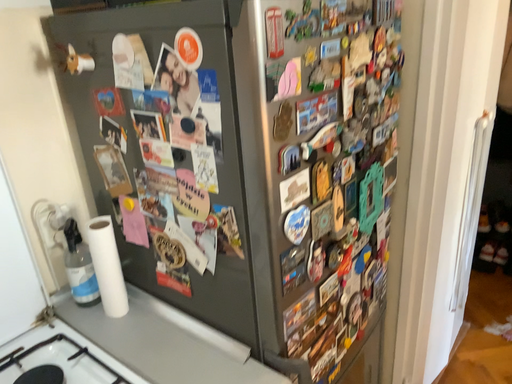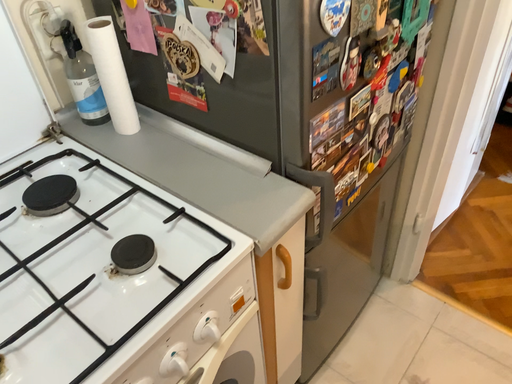
Question: Which way did the camera rotate in the video?

Choices:
 (A) rotated downward
 (B) rotated upward

Answer: (A)